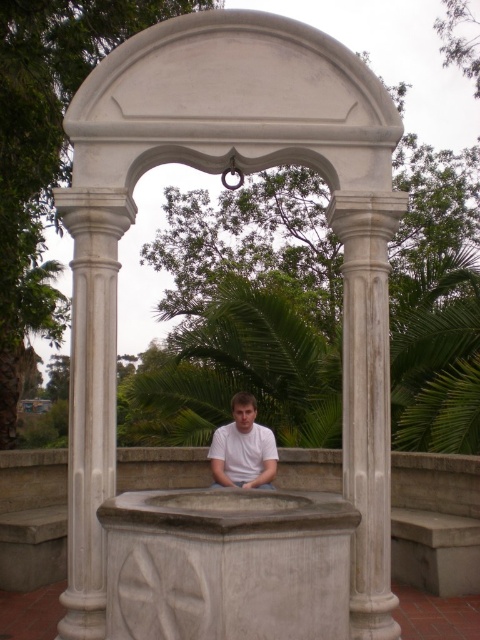
You are standing at the edge of the well and notice both the white marble pillar at center and the white matte shirt at center. Which object is positioned higher relative to the other?

The white marble pillar at center is located above the white matte shirt at center, so it is positioned higher.

You are standing in front of the classical stone well and want to touch both the white marble pillar at center and the white matte shirt at center. Which object will your hand reach first?

The white marble pillar at center is closer to the viewer than the white matte shirt at center, so you will reach the white marble pillar at center first.

You are standing at the edge of the well and want to place a white matte shirt at center on the ground next to the white marble pillar at center. Based on their widths, will the shirt fit without overlapping the pillar?

The white marble pillar at center might be wider than the white matte shirt at center, so there is a possibility that placing the shirt next to the pillar could result in overlapping if not positioned carefully.